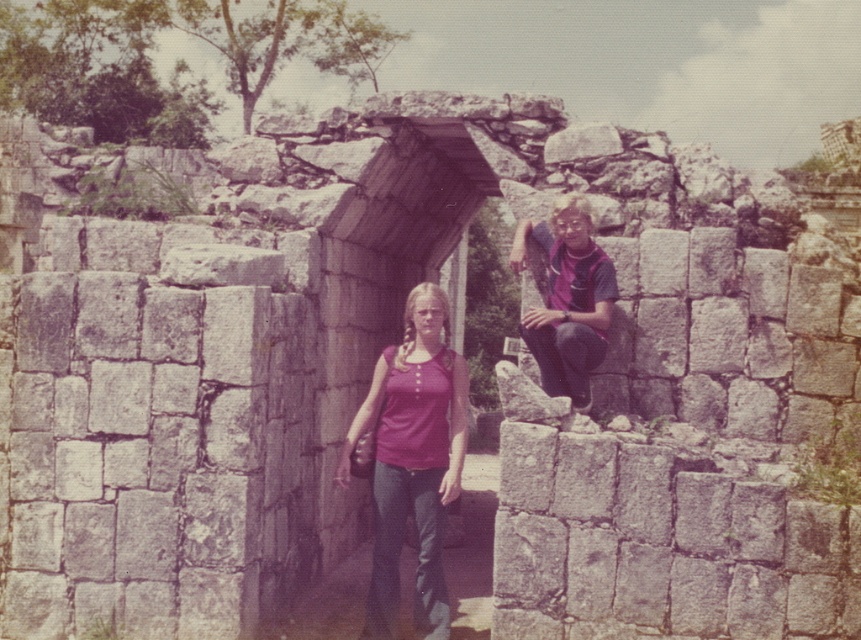
In the scene shown: Based on the coordinates provided, which object in the scene is positioned at point [412,460]?

The matte purple shirt at center is located at point [412,460].

You are a photographer trying to capture both the matte purple shirt at center and the purple fabric shirt at upper right in the same frame. Based on their positions, which one is closer to the bottom of the image?

The matte purple shirt at center is closer to the bottom of the image because it is positioned below the purple fabric shirt at upper right.